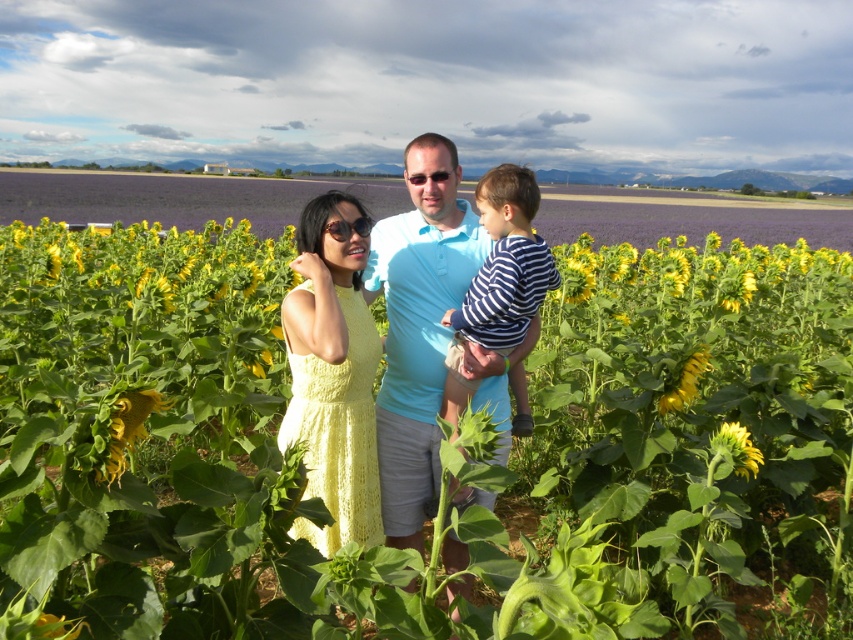
Question: Which point appears closest to the camera in this image?

Choices:
 (A) (347, 209)
 (B) (471, 273)

Answer: (A)

Question: Which of the following is the closest to the observer?

Choices:
 (A) light yellow knit dress at center
 (B) striped cotton shirt at center
 (C) yellow knitted dress at center

Answer: (A)

Question: Is yellow knitted dress at center further to the viewer compared to striped cotton shirt at center?

Choices:
 (A) no
 (B) yes

Answer: (A)

Question: Which point is farther to the camera?

Choices:
 (A) click(x=442, y=321)
 (B) click(x=334, y=237)

Answer: (A)

Question: Can you confirm if light yellow knit dress at center is positioned to the right of yellow knitted dress at center?

Choices:
 (A) yes
 (B) no

Answer: (A)

Question: Does light yellow knit dress at center lie behind striped cotton shirt at center?

Choices:
 (A) no
 (B) yes

Answer: (A)